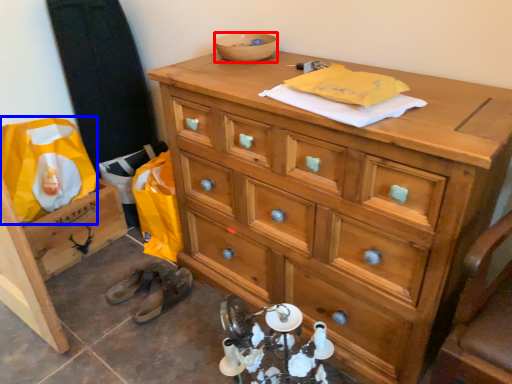
Question: Which of the following is the closest to the observer, bowl (highlighted by a red box) or material (highlighted by a blue box)?

Choices:
 (A) bowl
 (B) material

Answer: (A)